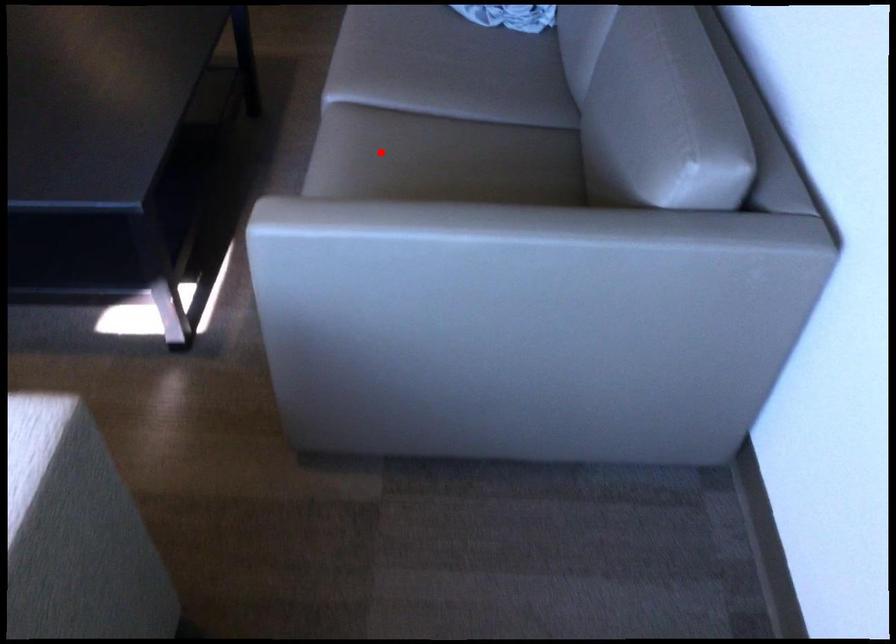
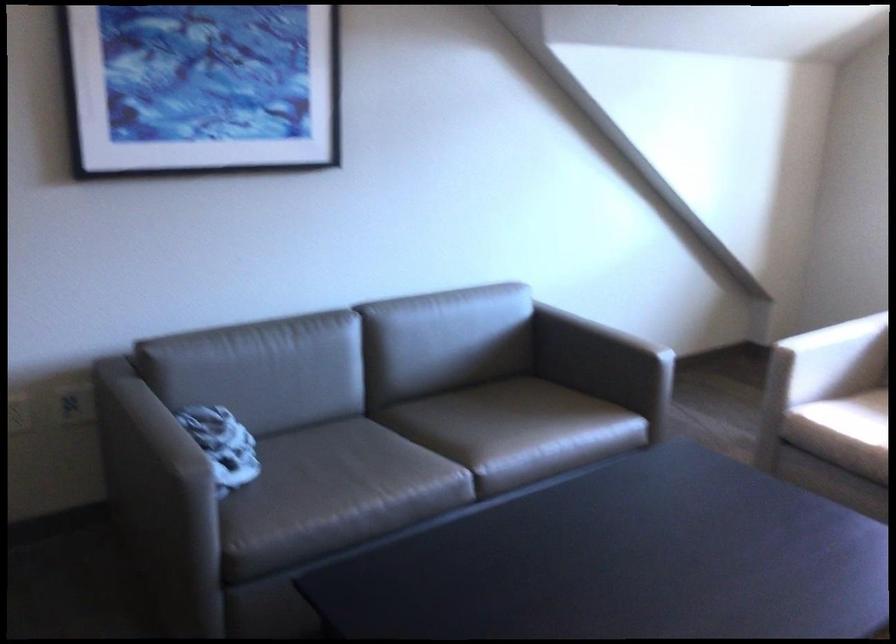
Question: I am providing you with two images of the same scene from different viewpoints. In image1, a red point is highlighted. Considering the same 3D point in image2, which of the following is correct?

Choices:
 (A) It is closer
 (B) It is farther

Answer: (B)